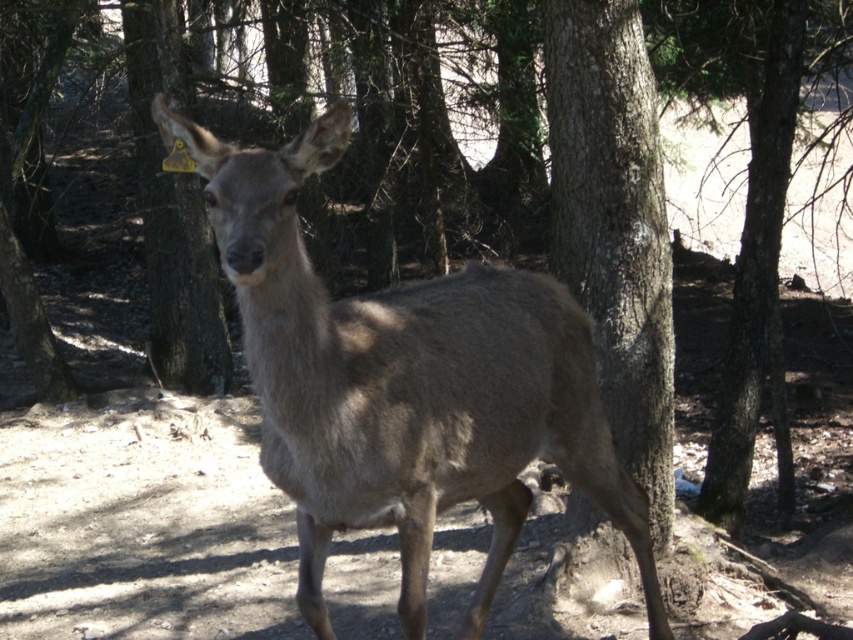
You are a wildlife researcher observing the gray fur deer at center from a distance. Your equipment can accurately measure distances up to 10 feet. Can you safely approach the deer to attach a tracking collar without exceeding your equipment range?

The gray fur deer at center is 9.06 feet away from the viewer. Since your equipment can measure up to 10 feet, you can safely approach the deer within that range to attach the tracking collar.

From the picture: You are a wildlife photographer aiming to capture a photo of the gray fur deer at center and the rough bark tree at center. Based on their positions, which object is closer to the left side of your camera frame?

The gray fur deer at center is closer to the left side of your camera frame because it is positioned to the left of the rough bark tree at center.